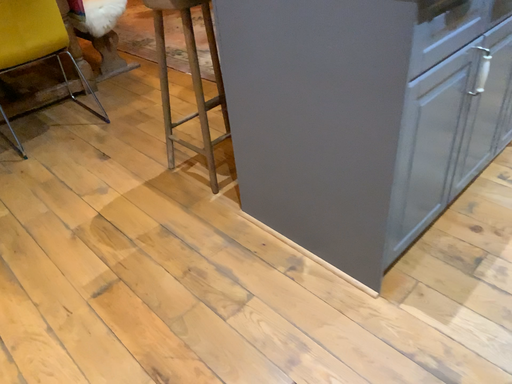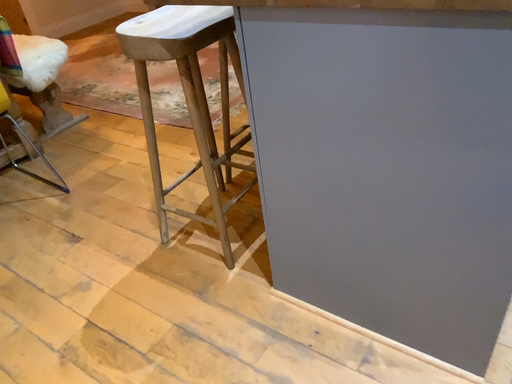
Question: How did the camera likely rotate when shooting the video?

Choices:
 (A) rotated left
 (B) rotated right

Answer: (B)